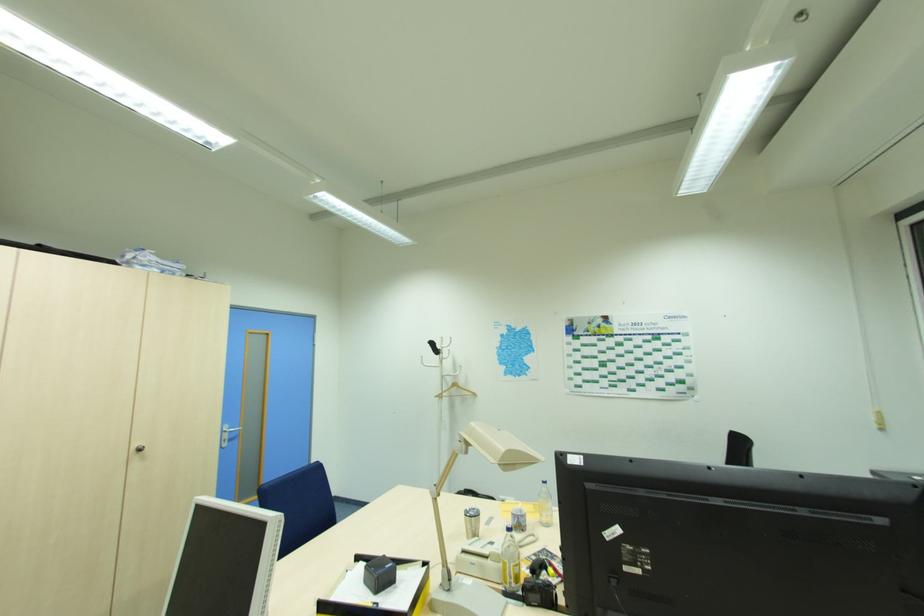
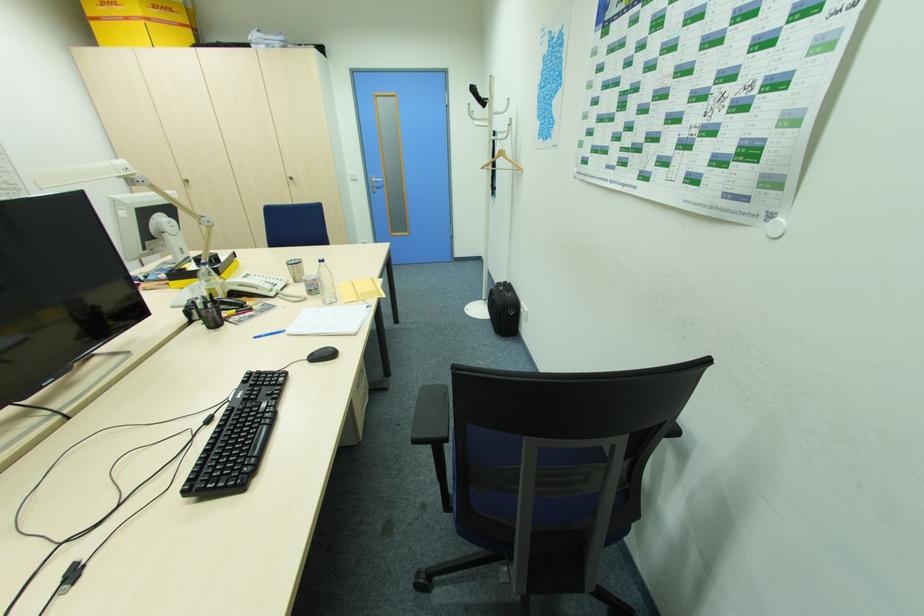
Locate, in the second image, the point that corresponds to (137,446) in the first image.

(292, 176)